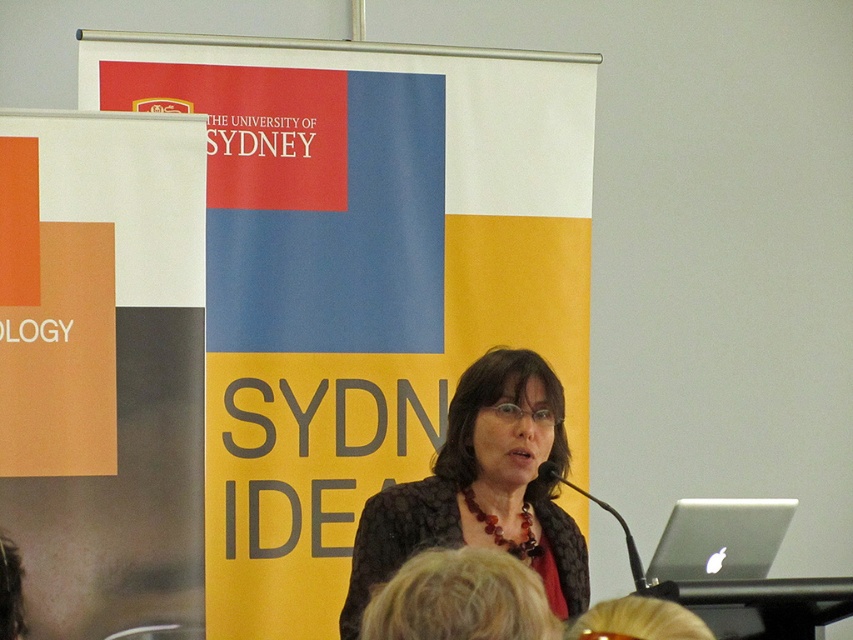
Question: Which of the following is the closest to the observer?

Choices:
 (A) click(x=744, y=572)
 (B) click(x=461, y=416)

Answer: (A)

Question: Does orange matte poster at left appear on the right side of silver metallic laptop at lower right?

Choices:
 (A) yes
 (B) no

Answer: (B)

Question: Observing the image, what is the correct spatial positioning of matte plastic banner at center in reference to matte black jacket at center?

Choices:
 (A) below
 (B) above

Answer: (B)

Question: Which object is the farthest from the matte plastic banner at center?

Choices:
 (A) silver metallic laptop at lower right
 (B) orange matte poster at left
 (C) matte black jacket at center

Answer: (A)

Question: Which object is positioned closest to the matte black jacket at center?

Choices:
 (A) orange matte poster at left
 (B) matte plastic banner at center
 (C) silver metallic laptop at lower right

Answer: (C)

Question: Does matte plastic banner at center appear on the left side of orange matte poster at left?

Choices:
 (A) yes
 (B) no

Answer: (B)